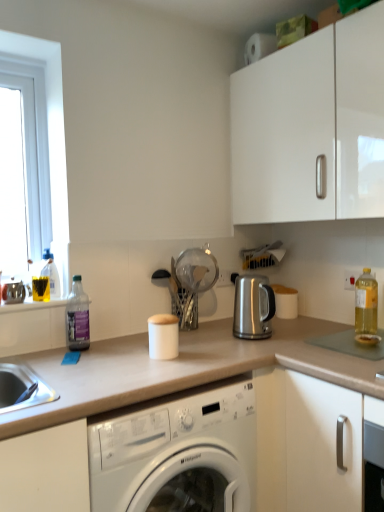
Question: Does clear plastic bottle at left, the 2th bottle in the right-to-left sequence, lie behind translucent plastic bottle at left, acting as the third bottle starting from the right?

Choices:
 (A) no
 (B) yes

Answer: (A)

Question: Does clear plastic bottle at left, which ranks as the 2th bottle in left-to-right order, turn towards translucent plastic bottle at left, placed as the 1th bottle when sorted from left to right?

Choices:
 (A) yes
 (B) no

Answer: (B)

Question: Considering the relative sizes of clear plastic bottle at left, the 2th bottle in the right-to-left sequence, and translucent plastic bottle at left, acting as the third bottle starting from the right, in the image provided, is clear plastic bottle at left, the 2th bottle in the right-to-left sequence, thinner than translucent plastic bottle at left, acting as the third bottle starting from the right,?

Choices:
 (A) yes
 (B) no

Answer: (B)

Question: From a real-world perspective, is clear plastic bottle at left, which ranks as the 2th bottle in left-to-right order, under translucent plastic bottle at left, acting as the third bottle starting from the right?

Choices:
 (A) no
 (B) yes

Answer: (B)

Question: Does clear plastic bottle at left, which ranks as the 2th bottle in left-to-right order, appear on the right side of translucent plastic bottle at left, acting as the third bottle starting from the right?

Choices:
 (A) no
 (B) yes

Answer: (B)

Question: From the image's perspective, is clear plastic bottle at left, the 2th bottle in the right-to-left sequence, below translucent plastic bottle at left, acting as the third bottle starting from the right?

Choices:
 (A) yes
 (B) no

Answer: (A)

Question: Is satin silver outlet at center surrounded by translucent yellow bottle at right, placed as the third bottle when sorted from left to right?

Choices:
 (A) no
 (B) yes

Answer: (A)

Question: Considering the relative positions of translucent yellow bottle at right, placed as the third bottle when sorted from left to right, and satin silver outlet at center in the image provided, is translucent yellow bottle at right, placed as the third bottle when sorted from left to right, to the left of satin silver outlet at center from the viewer's perspective?

Choices:
 (A) yes
 (B) no

Answer: (B)

Question: From the image's perspective, is translucent yellow bottle at right, which appears as the first bottle when viewed from the right, over satin silver outlet at center?

Choices:
 (A) no
 (B) yes

Answer: (A)

Question: From the image's perspective, would you say translucent yellow bottle at right, which appears as the first bottle when viewed from the right, is shown under satin silver outlet at center?

Choices:
 (A) yes
 (B) no

Answer: (A)

Question: From a real-world perspective, is translucent yellow bottle at right, placed as the third bottle when sorted from left to right, positioned under satin silver outlet at center based on gravity?

Choices:
 (A) no
 (B) yes

Answer: (B)

Question: Does translucent yellow bottle at right, which appears as the first bottle when viewed from the right, have a greater height compared to satin silver outlet at center?

Choices:
 (A) yes
 (B) no

Answer: (A)

Question: Are white glossy cabinet at upper right and transparent glass strainer at center, the second appliance when ordered from left to right, located far from each other?

Choices:
 (A) yes
 (B) no

Answer: (B)